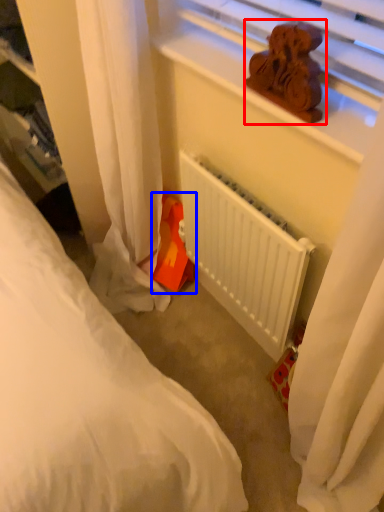
Question: Which of the following is the closest to the observer, miniature (highlighted by a red box) or stuff (highlighted by a blue box)?

Choices:
 (A) miniature
 (B) stuff

Answer: (A)